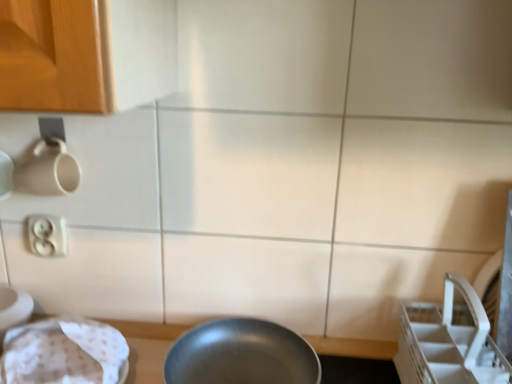
The height and width of the screenshot is (384, 512). I want to click on shiny silver frying pan at center, so click(x=241, y=355).

Locate an element on the screen. The width and height of the screenshot is (512, 384). transparent plastic sink at lower left is located at coordinates (64, 353).

The height and width of the screenshot is (384, 512). Identify the location of shiny silver frying pan at center. (241, 355).

Considering the relative positions of white plastic electric outlet at upper left and shiny silver frying pan at center in the image provided, is white plastic electric outlet at upper left to the right of shiny silver frying pan at center from the viewer's perspective?

No.

Who is taller, white plastic electric outlet at upper left or shiny silver frying pan at center?

With more height is white plastic electric outlet at upper left.

Can you confirm if white plastic electric outlet at upper left is smaller than shiny silver frying pan at center?

Indeed, white plastic electric outlet at upper left has a smaller size compared to shiny silver frying pan at center.

In the image, there is a white plastic electric outlet at upper left. Where is `frying pan below it (from a real-world perspective)`? The image size is (512, 384). frying pan below it (from a real-world perspective) is located at coordinates (241, 355).

Looking at the image, does shiny silver frying pan at center seem bigger or smaller compared to white plastic electric outlet at upper left?

In the image, shiny silver frying pan at center appears to be larger than white plastic electric outlet at upper left.

Who is shorter, shiny silver frying pan at center or white plastic electric outlet at upper left?

shiny silver frying pan at center is shorter.

From the image's perspective, would you say shiny silver frying pan at center is shown under white plastic electric outlet at upper left?

Correct, shiny silver frying pan at center appears lower than white plastic electric outlet at upper left in the image.

Could you tell me if shiny silver frying pan at center is turned towards white plastic electric outlet at upper left?

No, shiny silver frying pan at center is not facing towards white plastic electric outlet at upper left.

Does shiny silver frying pan at center have a greater height compared to transparent plastic sink at lower left?

No.

Is shiny silver frying pan at center next to transparent plastic sink at lower left and touching it?

shiny silver frying pan at center and transparent plastic sink at lower left are not in contact.

Considering the relative positions of shiny silver frying pan at center and transparent plastic sink at lower left in the image provided, is shiny silver frying pan at center to the right of transparent plastic sink at lower left from the viewer's perspective?

Yes.

Which is nearer, (292, 338) or (61, 363)?

Clearly, point (292, 338) is more distant from the camera than point (61, 363).

Can you tell me how much transparent plastic sink at lower left and white plastic electric outlet at upper left differ in facing direction?

The angular difference between transparent plastic sink at lower left and white plastic electric outlet at upper left is 2.74 degrees.

Is transparent plastic sink at lower left bigger or smaller than white plastic electric outlet at upper left?

transparent plastic sink at lower left is bigger than white plastic electric outlet at upper left.

Between point (93, 350) and point (60, 218), which one is positioned behind?

The point (60, 218) is behind.

Would you say transparent plastic sink at lower left is to the left or to the right of white plastic electric outlet at upper left in the picture?

transparent plastic sink at lower left is positioned on white plastic electric outlet at upper left's right side.

Relative to shiny silver frying pan at center, is transparent plastic sink at lower left in front or behind?

In the image, transparent plastic sink at lower left appears in front of shiny silver frying pan at center.

From a real-world perspective, is transparent plastic sink at lower left physically located above or below shiny silver frying pan at center?

Clearly, from a real-world perspective, transparent plastic sink at lower left is above shiny silver frying pan at center.

From the image's perspective, is transparent plastic sink at lower left above shiny silver frying pan at center?

Yes, from the image's perspective, transparent plastic sink at lower left is over shiny silver frying pan at center.

Does white plastic electric outlet at upper left have a larger size compared to transparent plastic sink at lower left?

No, white plastic electric outlet at upper left is not bigger than transparent plastic sink at lower left.

Which is in front, point (59, 227) or point (45, 361)?

Positioned in front is point (45, 361).

Does white plastic electric outlet at upper left have a lesser height compared to transparent plastic sink at lower left?

→ Yes, white plastic electric outlet at upper left is shorter than transparent plastic sink at lower left.

In the scene shown: Does white plastic electric outlet at upper left contain transparent plastic sink at lower left?

No, transparent plastic sink at lower left is not inside white plastic electric outlet at upper left.

Identify the location of electric outlet on the left of shiny silver frying pan at center. (47, 235).

Where is `electric outlet located behind the shiny silver frying pan at center`? electric outlet located behind the shiny silver frying pan at center is located at coordinates (47, 235).

Based on their spatial positions, is shiny silver frying pan at center or transparent plastic sink at lower left further from white plastic electric outlet at upper left?

Among the two, shiny silver frying pan at center is located further to white plastic electric outlet at upper left.

Looking at this image, from the image, which object appears to be nearer to white plastic electric outlet at upper left, transparent plastic sink at lower left or shiny silver frying pan at center?

transparent plastic sink at lower left is closer to white plastic electric outlet at upper left.

From the image, which object appears to be nearer to shiny silver frying pan at center, white plastic electric outlet at upper left or transparent plastic sink at lower left?

Based on the image, transparent plastic sink at lower left appears to be nearer to shiny silver frying pan at center.

From the image, which object appears to be nearer to transparent plastic sink at lower left, shiny silver frying pan at center or white plastic electric outlet at upper left?

Among the two, white plastic electric outlet at upper left is located nearer to transparent plastic sink at lower left.

Considering their positions, is white plastic electric outlet at upper left positioned closer to transparent plastic sink at lower left than shiny silver frying pan at center?

white plastic electric outlet at upper left is closer to transparent plastic sink at lower left.

When comparing their distances from shiny silver frying pan at center, does transparent plastic sink at lower left or white plastic electric outlet at upper left seem closer?

transparent plastic sink at lower left is closer to shiny silver frying pan at center.

You are a GUI agent. You are given a task and a screenshot of the screen. Output one action in this format:
    pyautogui.click(x=<x>, y=<y>)
    Task: Click on the sink located between white plastic electric outlet at upper left and shiny silver frying pan at center in the left-right direction
    
    Given the screenshot: What is the action you would take?
    pyautogui.click(x=64, y=353)